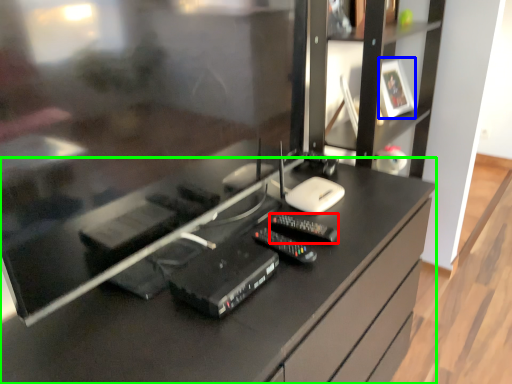
Question: Which is farther away from control (highlighted by a red box)? picture frame (highlighted by a blue box) or desk (highlighted by a green box)?

Choices:
 (A) picture frame
 (B) desk

Answer: (A)